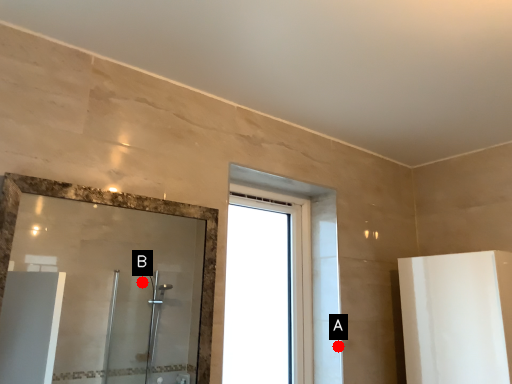
Question: Two points are circled on the image, labeled by A and B beside each circle. Which point is farther to the camera?

Choices:
 (A) A is further
 (B) B is further

Answer: (B)